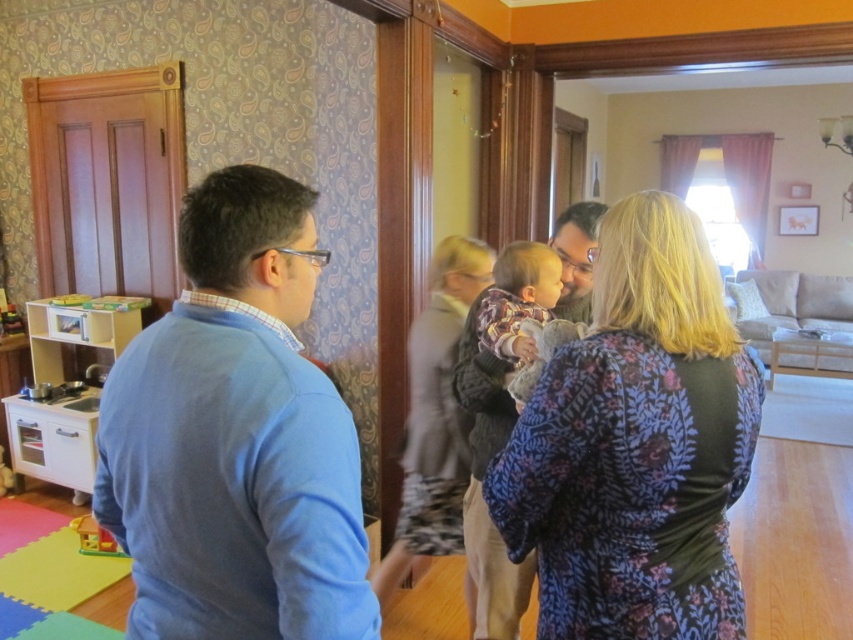
Which is more to the left, blue cotton sweater at left or floral fabric dress at center?

From the viewer's perspective, blue cotton sweater at left appears more on the left side.

Is blue cotton sweater at left in front of floral fabric dress at center?

Yes.

Is point (285, 304) in front of point (648, 436)?

Yes, it is in front of point (648, 436).

Locate an element on the screen. blue cotton sweater at left is located at coordinates (235, 436).

Does blue cotton sweater at left appear on the left side of wooden toy kitchen at lower left?

No, blue cotton sweater at left is not to the left of wooden toy kitchen at lower left.

You are a GUI agent. You are given a task and a screenshot of the screen. Output one action in this format:
    pyautogui.click(x=<x>, y=<y>)
    Task: Click on the blue cotton sweater at left
    
    Given the screenshot: What is the action you would take?
    pyautogui.click(x=235, y=436)

Does smooth beige shirt at center appear over wooden toy kitchen at lower left?

Yes, smooth beige shirt at center is above wooden toy kitchen at lower left.

This screenshot has height=640, width=853. Find the location of `smooth beige shirt at center`. smooth beige shirt at center is located at coordinates (x=480, y=496).

The width and height of the screenshot is (853, 640). In order to click on smooth beige shirt at center in this screenshot , I will do `click(480, 496)`.